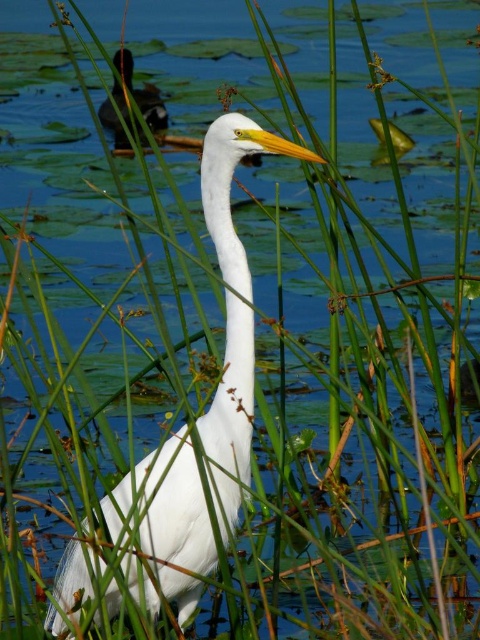
Consider the image. You are a photographer trying to capture the white matte bird at center and the shiny black duck at upper left in a single shot. Based on their positions, which one is closer to the bottom edge of your camera frame?

The white matte bird at center is closer to the bottom edge of the camera frame because it is positioned below the shiny black duck at upper left.

You are standing at the point labeled as point (67, 545) and want to throw a pebble into the water. If the water is 2.78 meters away from you, will the pebble reach the water?

The point labeled as point (67, 545) is 2.78 meters away from the viewer. Since the water is at that distance, the pebble will reach the water if thrown accurately.